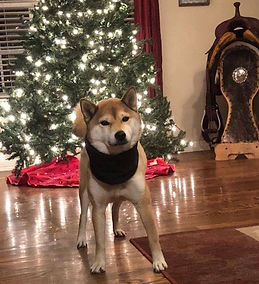
The height and width of the screenshot is (284, 259). Find the location of `curtains`. curtains is located at coordinates (154, 49).